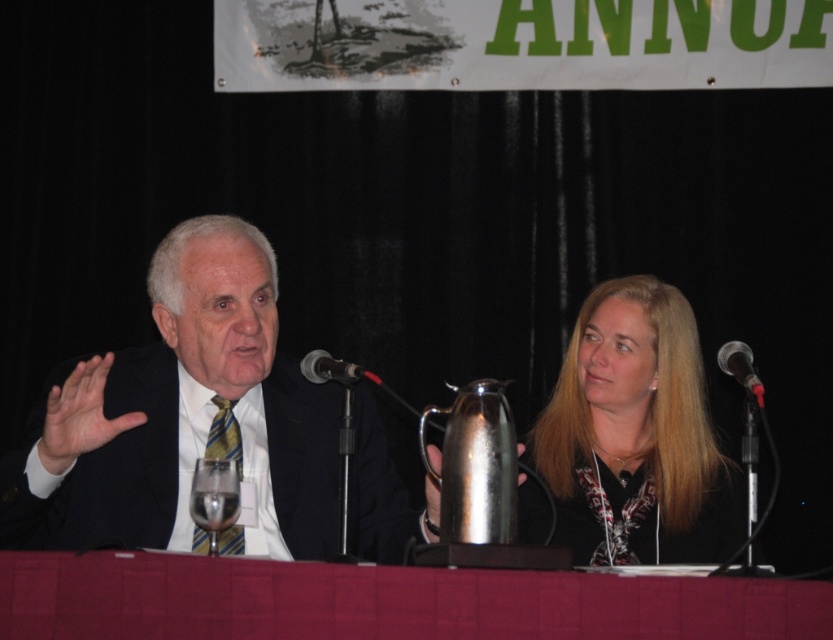
Which is more to the left, smooth red tablecloth at center or smooth black hair at center?

smooth red tablecloth at center is more to the left.

Where is `smooth red tablecloth at center`? This screenshot has width=833, height=640. smooth red tablecloth at center is located at coordinates (383, 602).

Can you confirm if smooth red tablecloth at center is wider than black metallic microphone at center?

Yes.

Does smooth red tablecloth at center have a larger size compared to black metallic microphone at center?

Yes, smooth red tablecloth at center is bigger than black metallic microphone at center.

Image resolution: width=833 pixels, height=640 pixels. Identify the location of smooth red tablecloth at center. (383, 602).

I want to click on smooth red tablecloth at center, so click(x=383, y=602).

Can you confirm if smooth black hair at center is taller than metallic/matte microphone at right?

Yes.

Measure the distance between smooth black hair at center and metallic/matte microphone at right.

smooth black hair at center is 16.38 inches from metallic/matte microphone at right.

Is point (729, 481) positioned after point (736, 365)?

Yes, point (729, 481) is farther from viewer.

Where is `smooth black hair at center`? This screenshot has width=833, height=640. smooth black hair at center is located at coordinates (636, 435).